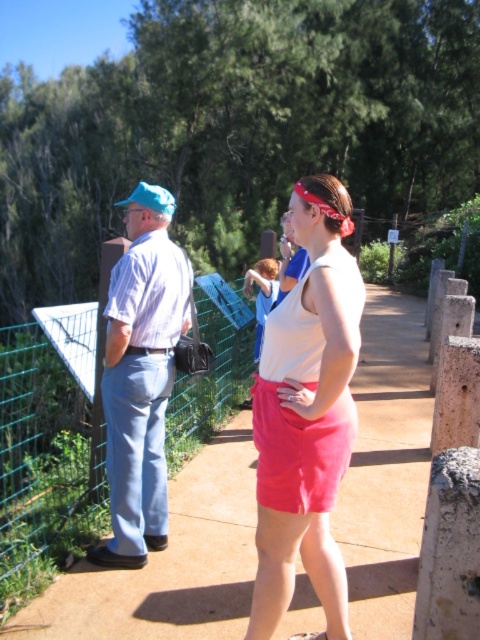
Who is shorter, green wire mesh fence at left or light blue denim pants at left?

With less height is green wire mesh fence at left.

Is the position of green wire mesh fence at left less distant than that of light blue denim pants at left?

That is False.

Find the location of a particular element. green wire mesh fence at left is located at coordinates (44, 464).

Is sandy concrete sidewalk at center smaller than green wire mesh fence at left?

Actually, sandy concrete sidewalk at center might be larger than green wire mesh fence at left.

Is point (235, 476) farther from camera compared to point (213, 285)?

No, it is not.

Between point (201, 579) and point (13, 352), which one is positioned in front?

Point (201, 579) is more forward.

Where is `sandy concrete sidewalk at center`? sandy concrete sidewalk at center is located at coordinates point(169,563).

Can you confirm if sandy concrete sidewalk at center is taller than light blue denim pants at left?

No.

Which is in front, point (216, 484) or point (157, 388)?

Point (157, 388)

Measure the distance between point (x=361, y=524) and camera.

Point (x=361, y=524) is 12.51 feet from camera.

You are a GUI agent. You are given a task and a screenshot of the screen. Output one action in this format:
    pyautogui.click(x=<x>, y=<y>)
    Task: Click on the sandy concrete sidewalk at center
    
    Given the screenshot: What is the action you would take?
    pyautogui.click(x=169, y=563)